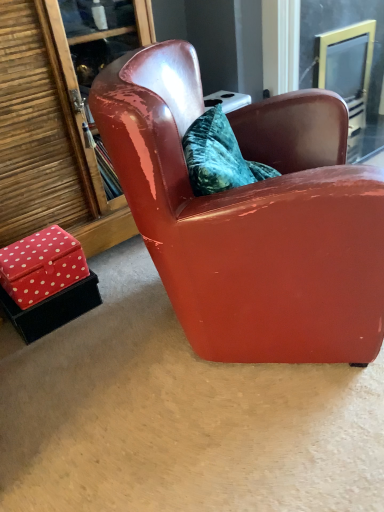
The height and width of the screenshot is (512, 384). I want to click on free point above red velvet box at lower left, which is counted as the 2th box, starting from the bottom (from a real-world perspective), so (35, 250).